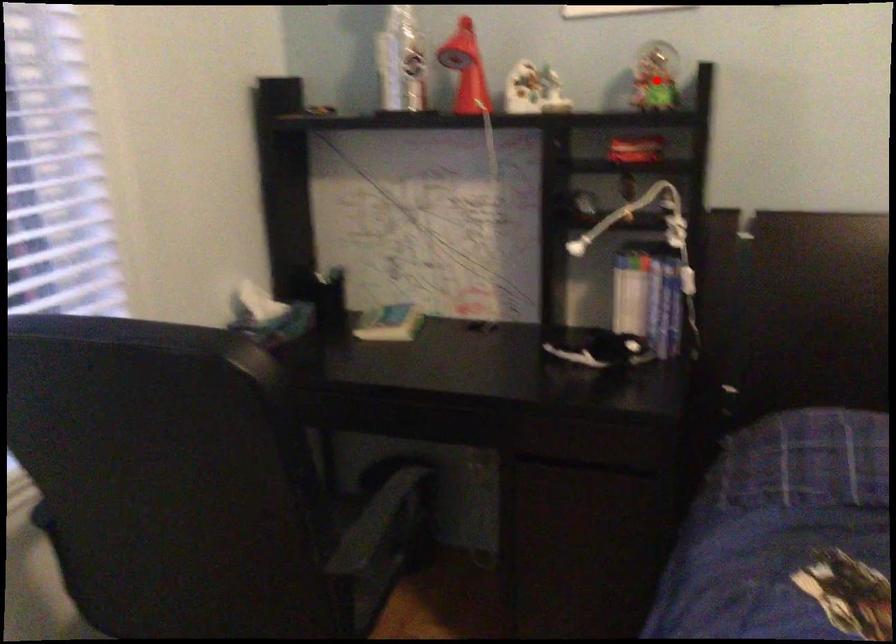
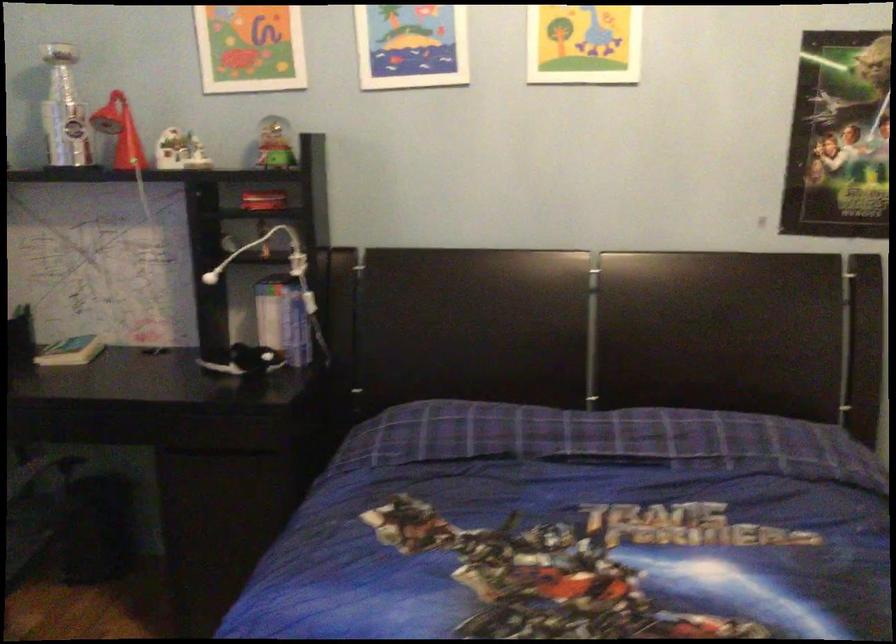
Question: A red point is marked in image1. In image2, is the corresponding 3D point closer to the camera or farther? Reply with the corresponding letter.

Choices:
 (A) The corresponding 3D point is closer.
 (B) The corresponding 3D point is farther.

Answer: (B)